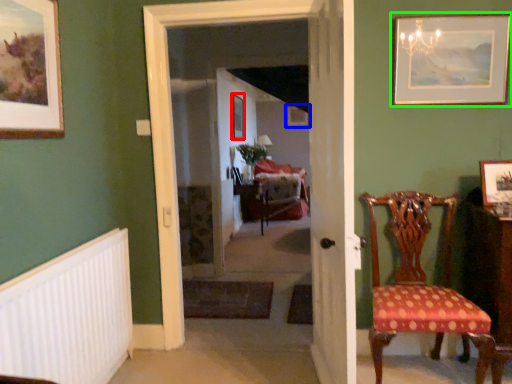
Question: Which object is the closest to the picture frame (highlighted by a red box)? Choose among these: picture frame (highlighted by a blue box) or picture frame (highlighted by a green box).

Choices:
 (A) picture frame
 (B) picture frame

Answer: (A)